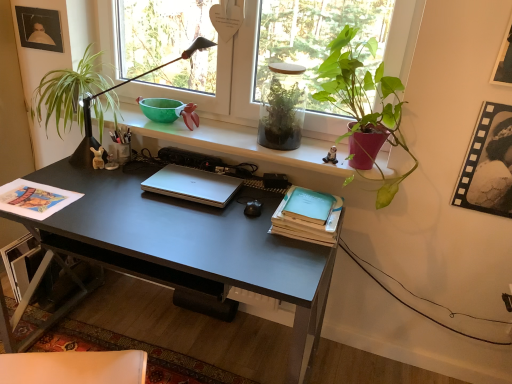
Identify the location of matte black desk at center. The image size is (512, 384). (190, 247).

Image resolution: width=512 pixels, height=384 pixels. Find the location of `matte black desk at center`. matte black desk at center is located at coordinates (237, 142).

What do you see at coordinates (282, 112) in the screenshot? The height and width of the screenshot is (384, 512). I see `translucent glass terrarium at center, which is counted as the 2th houseplant, starting from the right` at bounding box center [282, 112].

The image size is (512, 384). I want to click on transparent glass window at upper center, so click(219, 79).

Can you see matte black desk at center touching white plastic swivel chair at lower left?

matte black desk at center and white plastic swivel chair at lower left are not in contact.

Does matte black desk at center contain white plastic swivel chair at lower left?

Actually, white plastic swivel chair at lower left is outside matte black desk at center.

Considering the relative sizes of matte black desk at center and white plastic swivel chair at lower left in the image provided, is matte black desk at center bigger than white plastic swivel chair at lower left?

Actually, matte black desk at center might be smaller than white plastic swivel chair at lower left.

Which object is closer to the camera, matte black desk at center or white plastic swivel chair at lower left?

white plastic swivel chair at lower left is more forward.

Can you tell me how much green leafy plant at left, the 1th houseplant positioned from the left, and matte black desk at center differ in facing direction?

There is a 1.53-degree angle between the facing directions of green leafy plant at left, the 1th houseplant positioned from the left, and matte black desk at center.

Who is bigger, green leafy plant at left, the 1th houseplant positioned from the left, or matte black desk at center?

green leafy plant at left, the 1th houseplant positioned from the left.

Where is `window sill below the green leafy plant at left, the 1th houseplant positioned from the left (from the image's perspective)`? window sill below the green leafy plant at left, the 1th houseplant positioned from the left (from the image's perspective) is located at coordinates (237, 142).

Considering the sizes of objects green leafy plant at left, which is the 3th houseplant from right to left, and matte black desk at center in the image provided, who is taller, green leafy plant at left, which is the 3th houseplant from right to left, or matte black desk at center?

With more height is green leafy plant at left, which is the 3th houseplant from right to left.

Can you confirm if black filmstrip at upper right, which appears as the first picture frame when ordered from the bottom, is positioned to the left of transparent glass window at upper center?

Incorrect, black filmstrip at upper right, which appears as the first picture frame when ordered from the bottom, is not on the left side of transparent glass window at upper center.

Which object is closer to the camera taking this photo, black filmstrip at upper right, the second picture frame in the top-to-bottom sequence, or transparent glass window at upper center?

black filmstrip at upper right, the second picture frame in the top-to-bottom sequence, is closer to the camera.

Looking at this image, is black filmstrip at upper right, which appears as the second picture frame when viewed from the back, looking in the opposite direction of transparent glass window at upper center?

black filmstrip at upper right, which appears as the second picture frame when viewed from the back, is not turned away from transparent glass window at upper center.

Are black filmstrip at upper right, which is the 2th picture frame from left to right, and transparent glass window at upper center located far from each other?

Indeed, black filmstrip at upper right, which is the 2th picture frame from left to right, is not near transparent glass window at upper center.

From the image's perspective, which is above, translucent glass terrarium at center, which ranks as the second houseplant in left-to-right order, or matte black picture frame at upper left, placed as the 2th picture frame when sorted from front to back?

matte black picture frame at upper left, placed as the 2th picture frame when sorted from front to back, appears higher in the image.

Does translucent glass terrarium at center, which ranks as the second houseplant in left-to-right order, touch matte black picture frame at upper left, which is the 1th picture frame from left to right?

There is a gap between translucent glass terrarium at center, which ranks as the second houseplant in left-to-right order, and matte black picture frame at upper left, which is the 1th picture frame from left to right.

Is translucent glass terrarium at center, which is counted as the 2th houseplant, starting from the right, facing away from matte black picture frame at upper left, which appears as the 1th picture frame when viewed from the back?

No.

The height and width of the screenshot is (384, 512). Identify the location of window behind the light blue matte paper at center right, arranged as the 1th paperback book when ordered from the bottom. (219, 79).

Is light blue matte paper at center right, arranged as the 1th paperback book when ordered from the bottom, beside transparent glass window at upper center?

No, light blue matte paper at center right, arranged as the 1th paperback book when ordered from the bottom, is not in contact with transparent glass window at upper center.

From a real-world perspective, is light blue matte paper at center right, arranged as the 1th paperback book when ordered from the bottom, physically located above or below transparent glass window at upper center?

light blue matte paper at center right, arranged as the 1th paperback book when ordered from the bottom, is below transparent glass window at upper center.

Is light blue matte paper at center right, arranged as the 1th paperback book when ordered from the bottom, looking in the opposite direction of transparent glass window at upper center?

No, light blue matte paper at center right, arranged as the 1th paperback book when ordered from the bottom, is not facing the opposite direction of transparent glass window at upper center.

Based on the photo, what's the angular difference between black filmstrip at upper right, the second picture frame in the top-to-bottom sequence, and green leafy plant at left, the 1th houseplant positioned from the left,'s facing directions?

1.77 degrees separate the facing orientations of black filmstrip at upper right, the second picture frame in the top-to-bottom sequence, and green leafy plant at left, the 1th houseplant positioned from the left.

Is black filmstrip at upper right, which appears as the first picture frame when viewed from the front, oriented away from green leafy plant at left, which is the 3th houseplant from right to left?

black filmstrip at upper right, which appears as the first picture frame when viewed from the front, does not have its back to green leafy plant at left, which is the 3th houseplant from right to left.

Would you say black filmstrip at upper right, acting as the 1th picture frame starting from the right, contains green leafy plant at left, which is the 3th houseplant from right to left?

Actually, green leafy plant at left, which is the 3th houseplant from right to left, is outside black filmstrip at upper right, acting as the 1th picture frame starting from the right.

Who is smaller, black filmstrip at upper right, which appears as the first picture frame when viewed from the front, or green leafy plant at left, which is the 3th houseplant from right to left?

Smaller between the two is black filmstrip at upper right, which appears as the first picture frame when viewed from the front.

Does point (293, 213) come farther from viewer compared to point (396, 92)?

No.

Is teal matte paperback book at right, the first paperback book when ordered from top to bottom, situated inside green matte plant at upper right, the 1th houseplant from the right, or outside?

teal matte paperback book at right, the first paperback book when ordered from top to bottom, lies outside green matte plant at upper right, the 1th houseplant from the right.

From the picture: From the image's perspective, is teal matte paperback book at right, the 2th paperback book ordered from the bottom, positioned above or below green matte plant at upper right, which ranks as the third houseplant in left-to-right order?

teal matte paperback book at right, the 2th paperback book ordered from the bottom, is situated lower than green matte plant at upper right, which ranks as the third houseplant in left-to-right order, in the image.

You are a GUI agent. You are given a task and a screenshot of the screen. Output one action in this format:
    pyautogui.click(x=<x>, y=<y>)
    Task: Click on the swivel chair below the matte black desk at center (from the image's perspective)
    
    Given the screenshot: What is the action you would take?
    pyautogui.click(x=74, y=367)

This screenshot has height=384, width=512. Find the location of `window sill on the right of the green leafy plant at left, the 1th houseplant positioned from the left`. window sill on the right of the green leafy plant at left, the 1th houseplant positioned from the left is located at coordinates (237, 142).

From the image, which object appears to be nearer to light blue matte paper at center right, arranged as the 1th paperback book when ordered from the bottom, transparent glass window at upper center or silver metallic laptop at center?

silver metallic laptop at center lies closer to light blue matte paper at center right, arranged as the 1th paperback book when ordered from the bottom, than the other object.

Based on their spatial positions, is green matte plant at upper right, which ranks as the third houseplant in left-to-right order, or black filmstrip at upper right, which appears as the first picture frame when ordered from the bottom, further from matte black picture frame at upper left, the first picture frame from the top?

black filmstrip at upper right, which appears as the first picture frame when ordered from the bottom, is positioned further to the anchor matte black picture frame at upper left, the first picture frame from the top.

From the image, which object appears to be farther from green leafy plant at left, the 1th houseplant positioned from the left, teal matte paperback book at right, the 2th paperback book ordered from the bottom, or matte black desk at center?

teal matte paperback book at right, the 2th paperback book ordered from the bottom.

Based on their spatial positions, is transparent glass window at upper center or green matte plant at upper right, which ranks as the third houseplant in left-to-right order, closer to green leafy plant at left, the 1th houseplant positioned from the left?

Among the two, transparent glass window at upper center is located nearer to green leafy plant at left, the 1th houseplant positioned from the left.

Considering their positions, is black filmstrip at upper right, the second picture frame in the top-to-bottom sequence, positioned further to translucent glass terrarium at center, which is counted as the 2th houseplant, starting from the right, than matte black desk at center?

black filmstrip at upper right, the second picture frame in the top-to-bottom sequence, is further to translucent glass terrarium at center, which is counted as the 2th houseplant, starting from the right.

Looking at the image, which one is located closer to white plastic swivel chair at lower left, matte black desk at center or teal matte paperback book at right, the first paperback book when ordered from top to bottom?

matte black desk at center is positioned closer to the anchor white plastic swivel chair at lower left.

When comparing their distances from translucent glass terrarium at center, which is counted as the 2th houseplant, starting from the right, does transparent glass window at upper center or white plastic swivel chair at lower left seem further?

white plastic swivel chair at lower left lies further to translucent glass terrarium at center, which is counted as the 2th houseplant, starting from the right, than the other object.

Based on their spatial positions, is transparent glass window at upper center or translucent glass terrarium at center, which is counted as the 2th houseplant, starting from the right, further from matte black desk at center?

transparent glass window at upper center is positioned further to the anchor matte black desk at center.

Locate an element on the screen. This screenshot has width=512, height=384. laptop between white plastic swivel chair at lower left and green leafy plant at left, the 1th houseplant positioned from the left, from front to back is located at coordinates (193, 185).

Locate an element on the screen. desk located between white plastic swivel chair at lower left and light blue matte paper at center right, the second paperback book when ordered from top to bottom, in the left-right direction is located at coordinates (190, 247).

Locate an element on the screen. The height and width of the screenshot is (384, 512). window sill between matte black desk at center and black filmstrip at upper right, which appears as the first picture frame when ordered from the bottom, from left to right is located at coordinates (237, 142).

This screenshot has width=512, height=384. What are the coordinates of `laptop between matte black picture frame at upper left, which appears as the 1th picture frame when viewed from the back, and black filmstrip at upper right, which is the 2th picture frame from left to right, from left to right` in the screenshot? It's located at (193, 185).